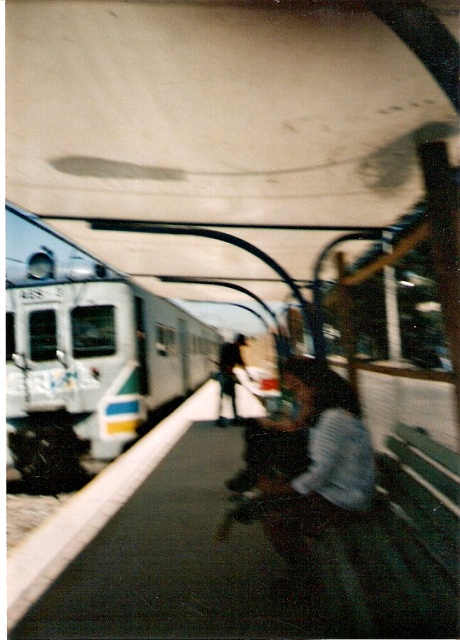
Consider the image. Can you confirm if silver metallic train at left is wider than dark blue jeans at center?

Indeed, silver metallic train at left has a greater width compared to dark blue jeans at center.

Based on the photo, can you confirm if silver metallic train at left is positioned to the left of dark blue jeans at center?

Correct, you'll find silver metallic train at left to the left of dark blue jeans at center.

Locate an element on the screen. This screenshot has width=460, height=640. silver metallic train at left is located at coordinates [86, 353].